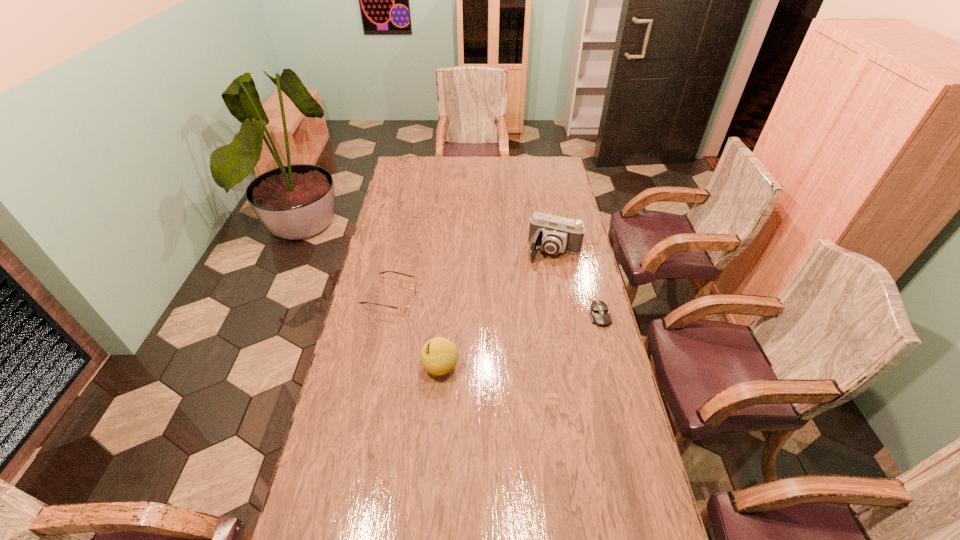
Image resolution: width=960 pixels, height=540 pixels. I want to click on vacant region that satisfies the following two spatial constraints: 1. on the back side of the second shortest object; 2. on the left side of the farthest object, so click(399, 251).